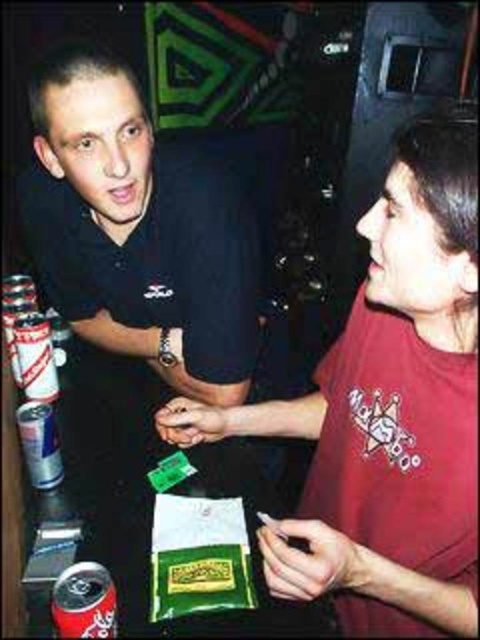
Who is positioned more to the right, red matte shirt at right or red matte soda can at lower left?

From the viewer's perspective, red matte shirt at right appears more on the right side.

Is red matte shirt at right taller than red matte soda can at lower left?

Correct, red matte shirt at right is much taller as red matte soda can at lower left.

Which is behind, point (425, 301) or point (106, 593)?

The point (106, 593) is behind.

Locate an element on the screen. The image size is (480, 640). red matte shirt at right is located at coordinates (387, 412).

Who is more forward, (466, 221) or (51, 440)?

Point (466, 221) is more forward.

Looking at this image, between red matte shirt at right and silver metallic can at left, which one has less height?

With less height is silver metallic can at left.

Does point (402, 131) lie behind point (25, 436)?

No, it is in front of (25, 436).

Where is `red matte shirt at right`? red matte shirt at right is located at coordinates (387, 412).

Between white cardboard can at left and silver metallic can at left, which one is positioned higher?

white cardboard can at left

Does white cardboard can at left appear under silver metallic can at left?

No, white cardboard can at left is not below silver metallic can at left.

Is point (29, 352) behind point (24, 454)?

Yes, it is behind point (24, 454).

I want to click on white cardboard can at left, so click(36, 356).